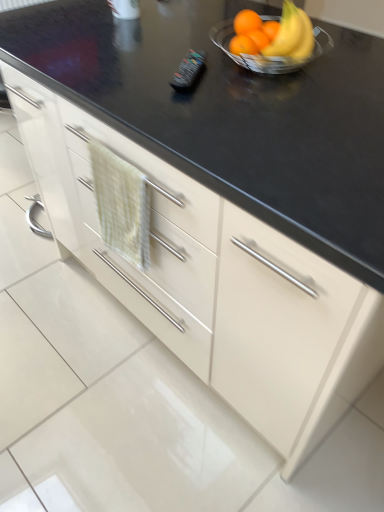
You are a GUI agent. You are given a task and a screenshot of the screen. Output one action in this format:
    pyautogui.click(x=<x>, y=<y>)
    Task: Click on the spots to the right of clear glass bowl at upper right
    Image resolution: width=384 pixels, height=512 pixels.
    Given the screenshot: What is the action you would take?
    pyautogui.click(x=349, y=56)